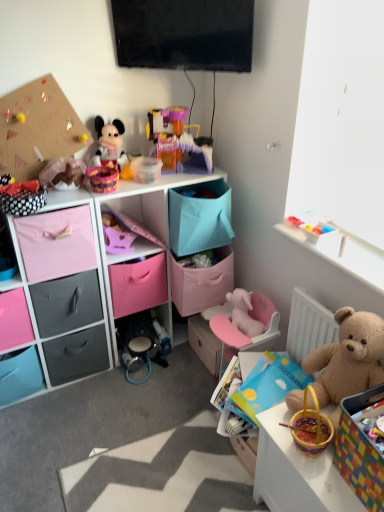
Question: Can you confirm if matte black drawer at lower left, the 4th drawer in the left-to-right sequence, is positioned to the right of pink fabric drawer at lower left, which ranks as the 6th drawer in right-to-left order?

Choices:
 (A) yes
 (B) no

Answer: (A)

Question: Is matte black drawer at lower left, the 4th drawer in the left-to-right sequence, positioned before pink fabric drawer at lower left, which ranks as the 6th drawer in right-to-left order?

Choices:
 (A) yes
 (B) no

Answer: (B)

Question: From a real-world perspective, is matte black drawer at lower left, the 4th drawer in the left-to-right sequence, below pink fabric drawer at lower left, which ranks as the 6th drawer in right-to-left order?

Choices:
 (A) yes
 (B) no

Answer: (A)

Question: From the image's perspective, would you say matte black drawer at lower left, the 4th drawer in the left-to-right sequence, is shown under pink fabric drawer at lower left, the second drawer viewed from the left?

Choices:
 (A) no
 (B) yes

Answer: (B)

Question: Does matte black drawer at lower left, the 4th drawer in the left-to-right sequence, have a larger size compared to pink fabric drawer at lower left, the second drawer viewed from the left?

Choices:
 (A) yes
 (B) no

Answer: (A)

Question: From the image's perspective, is matte black drawer at lower left, the 4th drawer in the left-to-right sequence, positioned above or below pink plush elephant at center, the 4th toy positioned from the left?

Choices:
 (A) above
 (B) below

Answer: (B)

Question: Is matte black drawer at lower left, the 4th drawer in the left-to-right sequence, taller or shorter than pink plush elephant at center, the 4th toy positioned from the left?

Choices:
 (A) tall
 (B) short

Answer: (A)

Question: In the image, is matte black drawer at lower left, the 4th drawer in the left-to-right sequence, on the left side or the right side of pink plush elephant at center, which appears as the 1th toy when ordered from the bottom?

Choices:
 (A) right
 (B) left

Answer: (B)

Question: Would you say matte black drawer at lower left, the 4th drawer in the left-to-right sequence, is inside or outside pink plush elephant at center, which ranks as the first toy in right-to-left order?

Choices:
 (A) inside
 (B) outside

Answer: (B)

Question: In terms of size, does pink fabric drawer at lower left, which appears as the seventh drawer when viewed from the right, appear bigger or smaller than pink fabric drawer at center, the 7th drawer positioned from the left?

Choices:
 (A) big
 (B) small

Answer: (A)

Question: From their relative heights in the image, would you say pink fabric drawer at lower left, marked as the first drawer in a left-to-right arrangement, is taller or shorter than pink fabric drawer at center, the first drawer in the right-to-left sequence?

Choices:
 (A) short
 (B) tall

Answer: (B)

Question: Is point (11, 359) closer or farther from the camera than point (216, 337)?

Choices:
 (A) closer
 (B) farther

Answer: (A)

Question: Would you say pink fabric drawer at lower left, which appears as the seventh drawer when viewed from the right, is inside or outside pink fabric drawer at center, the 7th drawer positioned from the left?

Choices:
 (A) outside
 (B) inside

Answer: (A)

Question: Is translucent plastic playset at upper center, which is the 1th toy in top-to-bottom order, wider or thinner than pink fabric drawer at lower left, marked as the first drawer in a left-to-right arrangement?

Choices:
 (A) wide
 (B) thin

Answer: (B)

Question: Is translucent plastic playset at upper center, which ranks as the second toy in right-to-left order, in front of or behind pink fabric drawer at lower left, marked as the first drawer in a left-to-right arrangement, in the image?

Choices:
 (A) behind
 (B) front

Answer: (A)